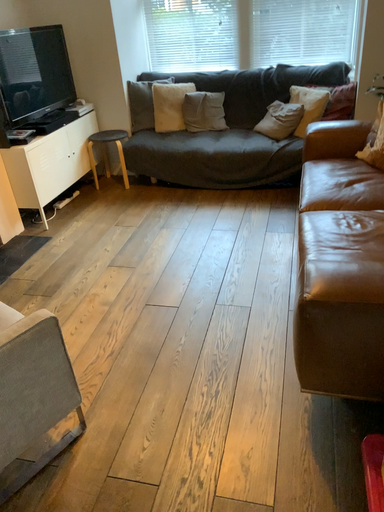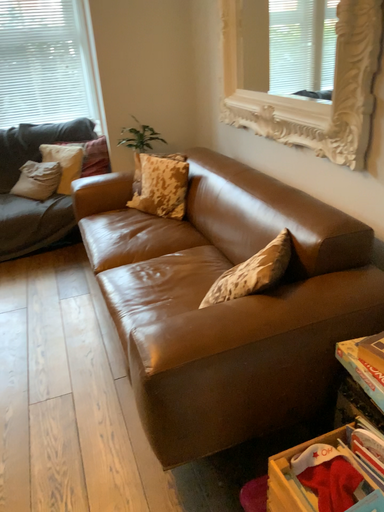
Question: Which way did the camera rotate in the video?

Choices:
 (A) rotated upward
 (B) rotated downward

Answer: (A)